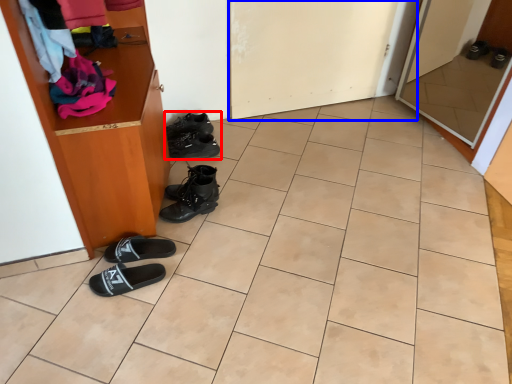
Question: Which point is closer to the camera, footwear (highlighted by a red box) or door (highlighted by a blue box)?

Choices:
 (A) footwear
 (B) door

Answer: (B)